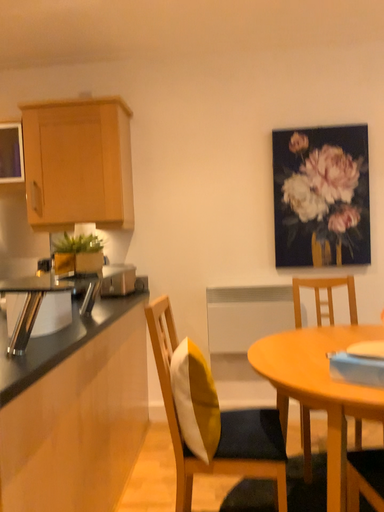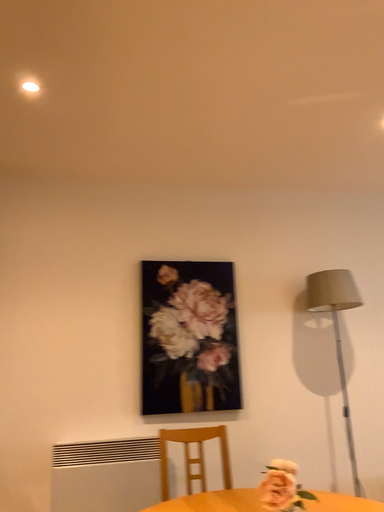
Question: How did the camera likely rotate when shooting the video?

Choices:
 (A) rotated right
 (B) rotated left

Answer: (A)